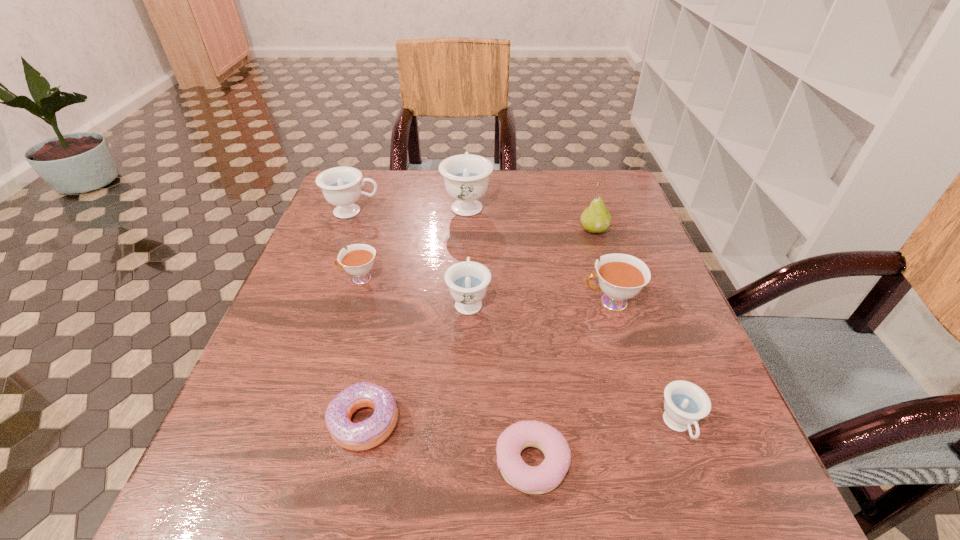
Where is `vacant space at the far left corner of the desktop`? vacant space at the far left corner of the desktop is located at coordinates (387, 181).

Identify the location of free space at the near left corner of the desktop. The width and height of the screenshot is (960, 540). (277, 536).

In order to click on vacant space at the far right corner in this screenshot , I will do `click(596, 191)`.

The height and width of the screenshot is (540, 960). In the image, there is a desktop. Identify the location of vacant space at the near right corner. (653, 481).

Identify the location of free point between the biggest blue teacup and the leftmost blue teacup. This screenshot has height=540, width=960. (410, 208).

Find the location of `vacant region between the right white teacup and the third biggest blue teacup`. vacant region between the right white teacup and the third biggest blue teacup is located at coordinates (540, 301).

Locate an element on the screen. The width and height of the screenshot is (960, 540). vacant area that lies between the third smallest blue teacup and the left doughnut is located at coordinates (359, 316).

Locate an element on the screen. vacant area that lies between the tallest teacup and the nearest blue teacup is located at coordinates (573, 315).

At what (x,y) coordinates should I click in order to perform the action: click on free area in between the nearest blue teacup and the green pear. Please return your answer as a coordinate pair (x, y). Looking at the image, I should click on (636, 328).

Image resolution: width=960 pixels, height=540 pixels. Find the location of `free spot between the pear and the second smallest blue teacup`. free spot between the pear and the second smallest blue teacup is located at coordinates (531, 265).